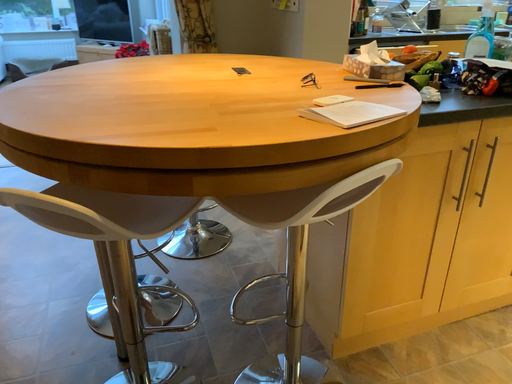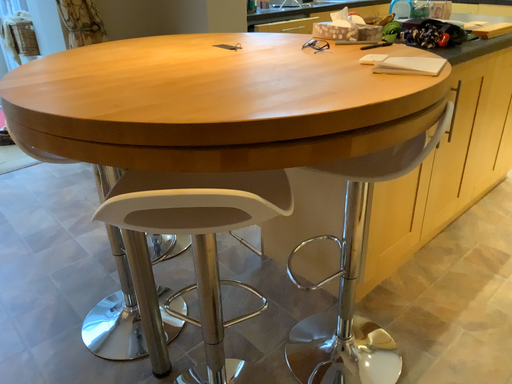
Question: Which way did the camera rotate in the video?

Choices:
 (A) rotated right
 (B) rotated left

Answer: (A)